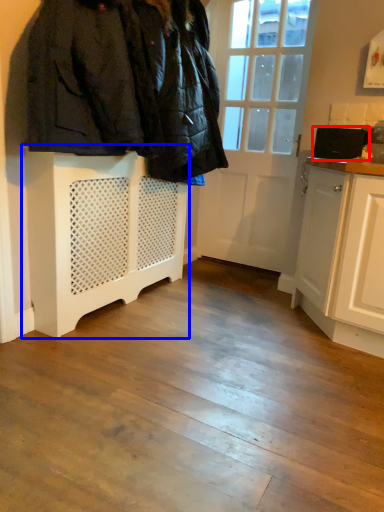
Question: Which object is further to the camera taking this photo, appliance (highlighted by a red box) or cabinetry (highlighted by a blue box)?

Choices:
 (A) appliance
 (B) cabinetry

Answer: (A)